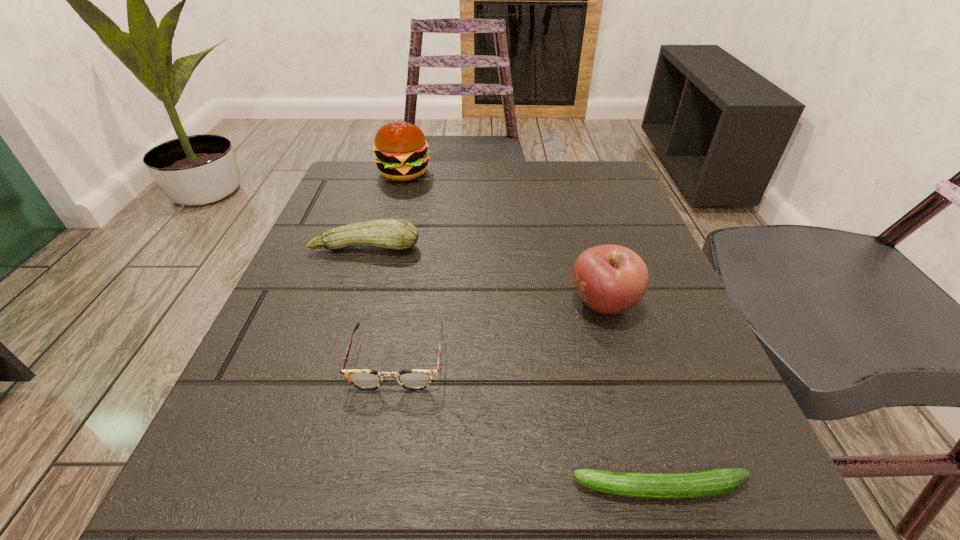
Locate an element on the screen. Image resolution: width=960 pixels, height=540 pixels. free space located on the front of the hamburger is located at coordinates (370, 298).

What are the coordinates of `vacant space located 0.390m on the side of the apple with the unique marking` in the screenshot? It's located at (327, 303).

Where is `blank space located on the side of the apple with the unique marking`? The height and width of the screenshot is (540, 960). blank space located on the side of the apple with the unique marking is located at coordinates (402, 303).

Locate an element on the screen. The height and width of the screenshot is (540, 960). vacant position located 0.090m on the side of the apple with the unique marking is located at coordinates (514, 303).

I want to click on free space located 0.260m at the stem end of the farther zucchini, so click(324, 374).

The image size is (960, 540). Identify the location of vacant space located on the frame of the second nearest object. (373, 491).

Find the location of a particular element. vacant space situated on the front-facing side of the right zucchini is located at coordinates (518, 488).

Image resolution: width=960 pixels, height=540 pixels. Identify the location of free location located 0.100m on the front-facing side of the right zucchini. (483, 488).

Where is `vacant region located on the front-facing side of the right zucchini`? The width and height of the screenshot is (960, 540). vacant region located on the front-facing side of the right zucchini is located at coordinates tap(401, 488).

The image size is (960, 540). Find the location of `object that is positioned at the far edge`. object that is positioned at the far edge is located at coordinates pos(401,152).